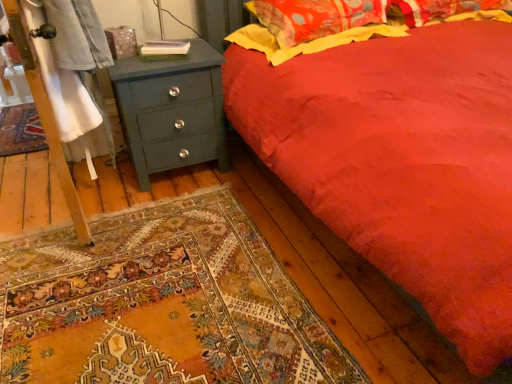
Question: From a real-world perspective, relative to teal painted wood chest of drawers at left, is fluffy cotton pillow at upper right vertically above or below?

Choices:
 (A) above
 (B) below

Answer: (A)

Question: Is fluffy cotton pillow at upper right spatially inside teal painted wood chest of drawers at left, or outside of it?

Choices:
 (A) outside
 (B) inside

Answer: (A)

Question: Is point (274, 3) closer or farther from the camera than point (214, 49)?

Choices:
 (A) closer
 (B) farther

Answer: (A)

Question: From the image's perspective, is teal painted wood chest of drawers at left positioned above or below fluffy cotton pillow at upper right?

Choices:
 (A) above
 (B) below

Answer: (B)

Question: Does point (170, 102) appear closer or farther from the camera than point (247, 4)?

Choices:
 (A) closer
 (B) farther

Answer: (A)

Question: Looking at the image, does teal painted wood chest of drawers at left seem bigger or smaller compared to fluffy cotton pillow at upper right?

Choices:
 (A) small
 (B) big

Answer: (B)

Question: In terms of height, does teal painted wood chest of drawers at left look taller or shorter compared to fluffy cotton pillow at upper right?

Choices:
 (A) tall
 (B) short

Answer: (A)